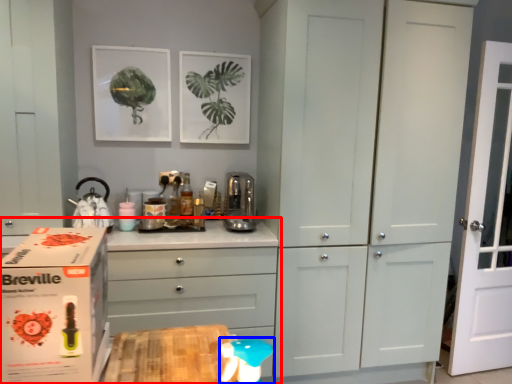
Question: Which object appears closest to the camera in this image, chest of drawers (highlighted by a red box) or toy (highlighted by a blue box)?

Choices:
 (A) chest of drawers
 (B) toy

Answer: (B)